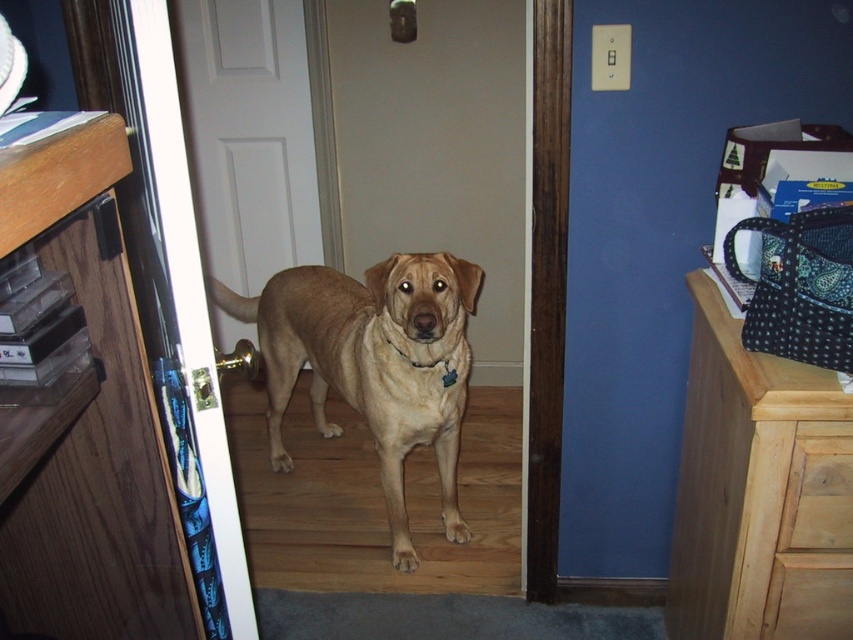
Is wooden dresser at right to the right of golden tan fur at center from the viewer's perspective?

Indeed, wooden dresser at right is positioned on the right side of golden tan fur at center.

Is point (790, 392) closer to viewer compared to point (437, 307)?

Yes, it is in front of point (437, 307).

Find the location of a particular element. The image size is (853, 640). wooden dresser at right is located at coordinates (759, 492).

I want to click on wooden dresser at right, so click(759, 492).

Is point (752, 618) positioned in front of point (386, 336)?

Yes, point (752, 618) is in front of point (386, 336).

Which is behind, point (718, 404) or point (444, 362)?

Point (444, 362)

Which is behind, point (775, 465) or point (401, 355)?

The point (401, 355) is behind.

The image size is (853, 640). In order to click on wooden dresser at right in this screenshot , I will do `click(759, 492)`.

Is wooden dresser at left further to the viewer compared to wooden dresser at right?

No, it is not.

Between wooden dresser at left and wooden dresser at right, which one has more height?

wooden dresser at right

Locate an element on the screen. The height and width of the screenshot is (640, 853). wooden dresser at left is located at coordinates (88, 422).

Locate an element on the screen. The width and height of the screenshot is (853, 640). wooden dresser at left is located at coordinates (88, 422).